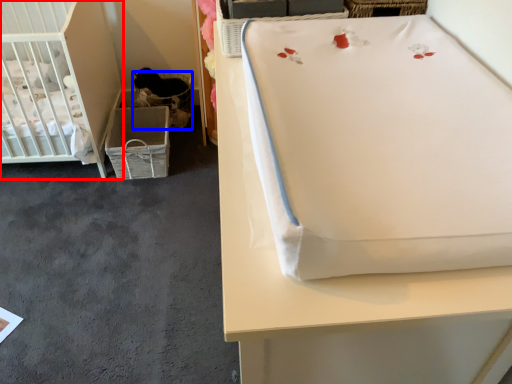
Question: Which point is further to the camera, infant bed (highlighted by a red box) or basket (highlighted by a blue box)?

Choices:
 (A) infant bed
 (B) basket

Answer: (B)